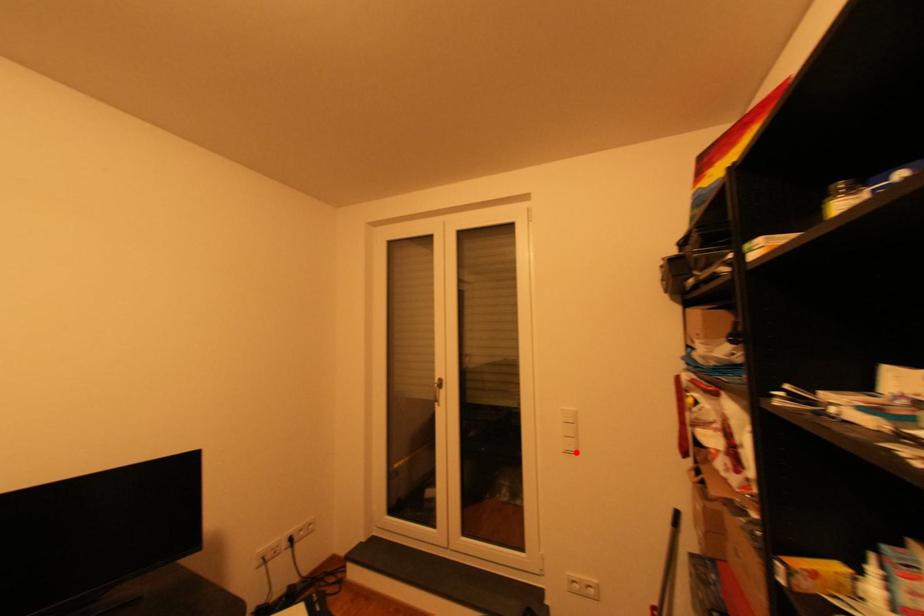
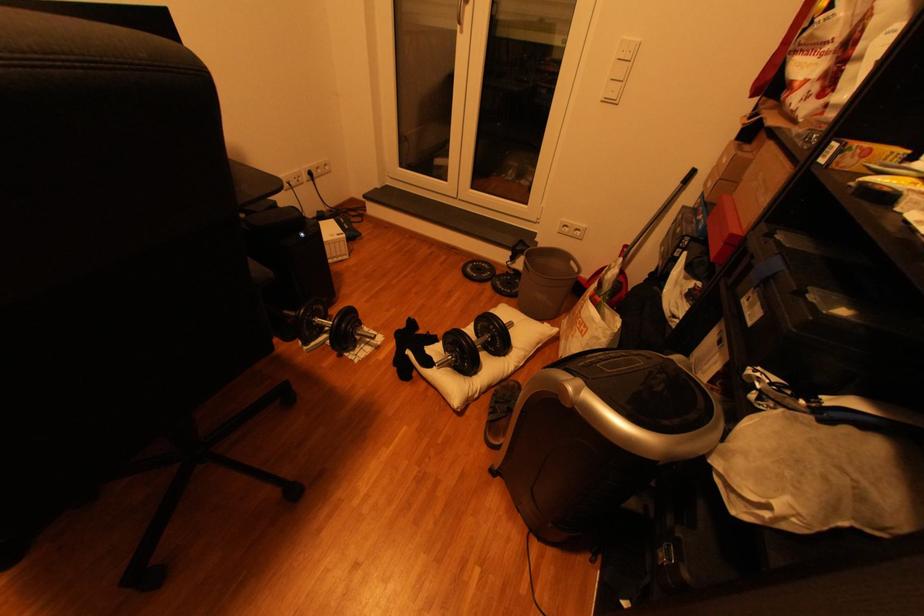
Question: I am providing you with two images of the same scene from different viewpoints. A red point is marked on the first image. Is the red point's position out of view in image 2?

Choices:
 (A) Yes
 (B) No

Answer: (B)